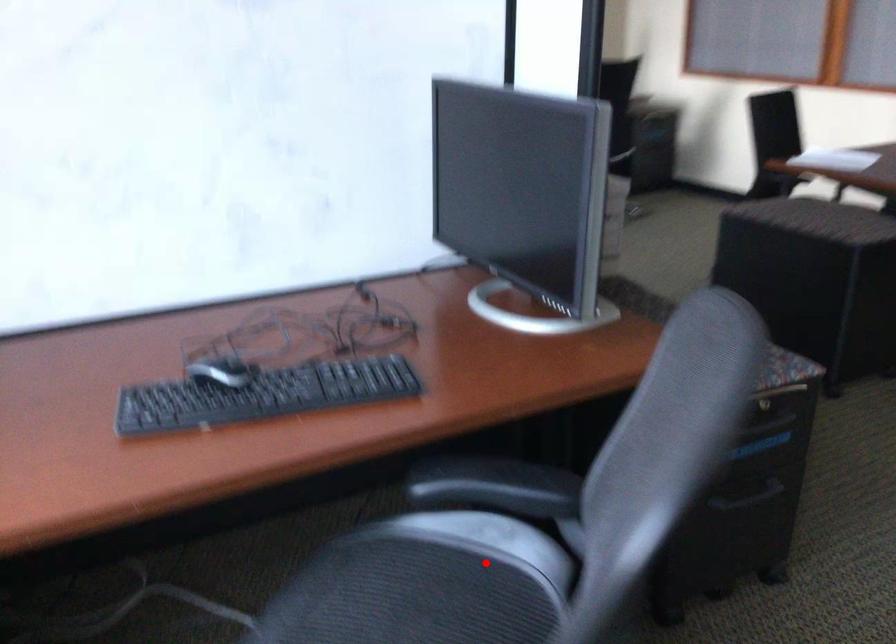
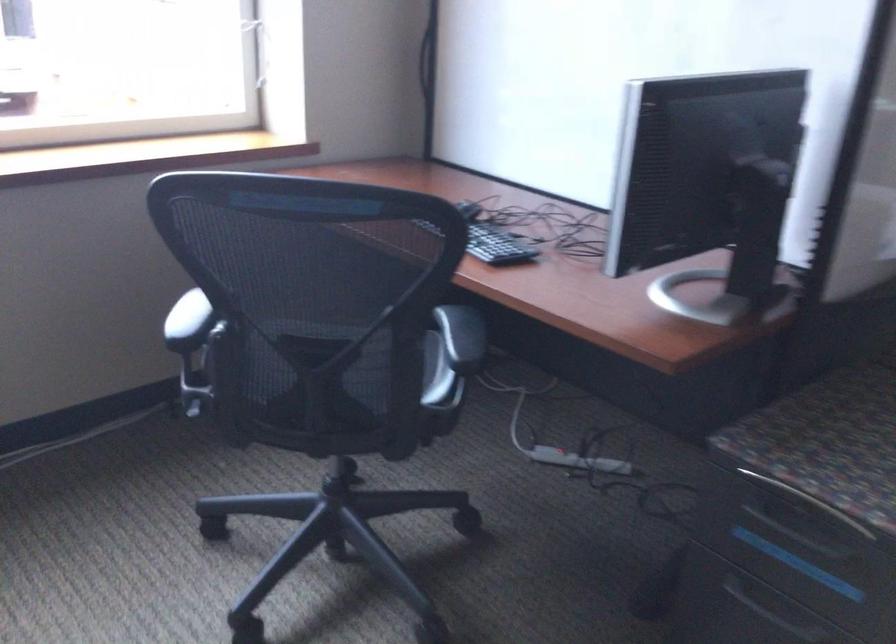
In the second image, find the point that corresponds to the highlighted location in the first image.

(435, 373)